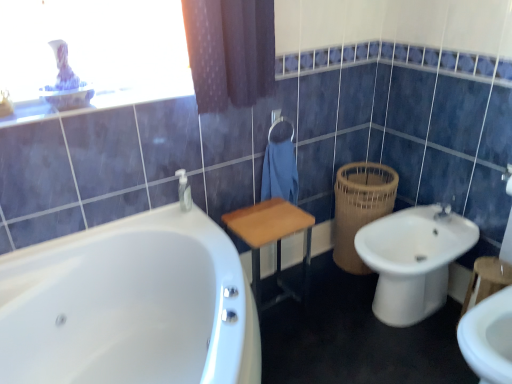
The width and height of the screenshot is (512, 384). What are the coordinates of `vacant area situated below white ceramic bidet at lower right (from a real-world perspective)` in the screenshot? It's located at (400, 323).